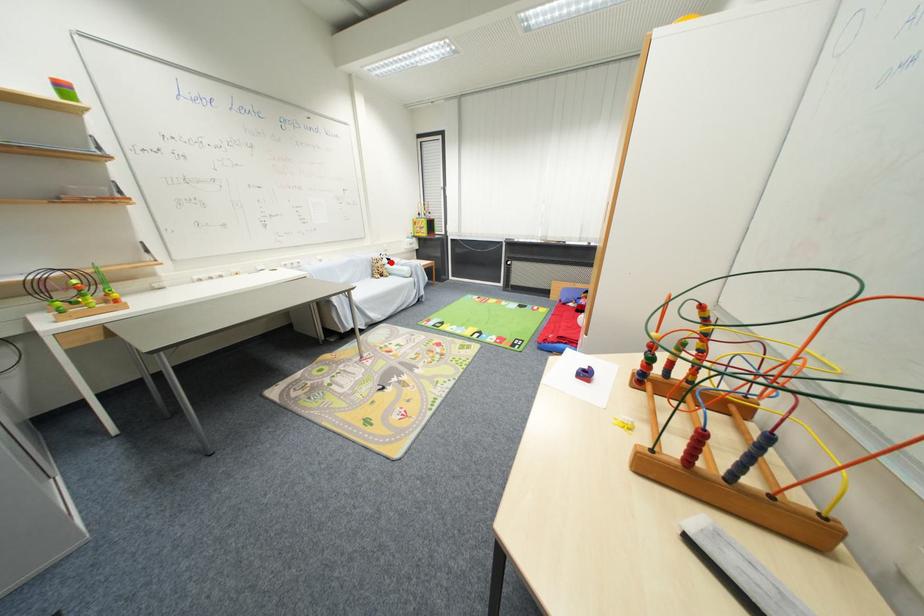
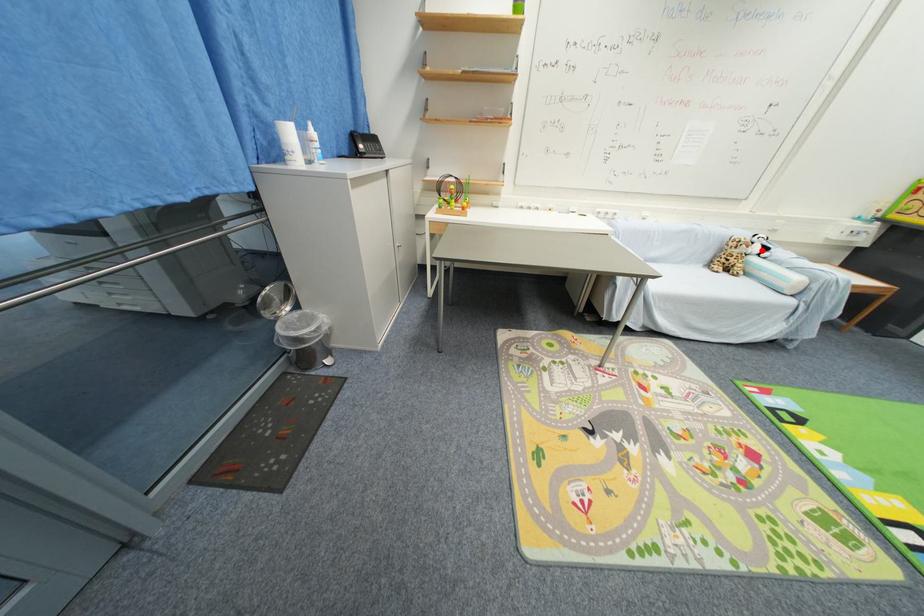
I am providing you with two images of the same scene from different viewpoints. A red point is marked on the first image and another point is marked on the second image. Do the highlighted points in image1 and image2 indicate the same real-world spot?

Yes